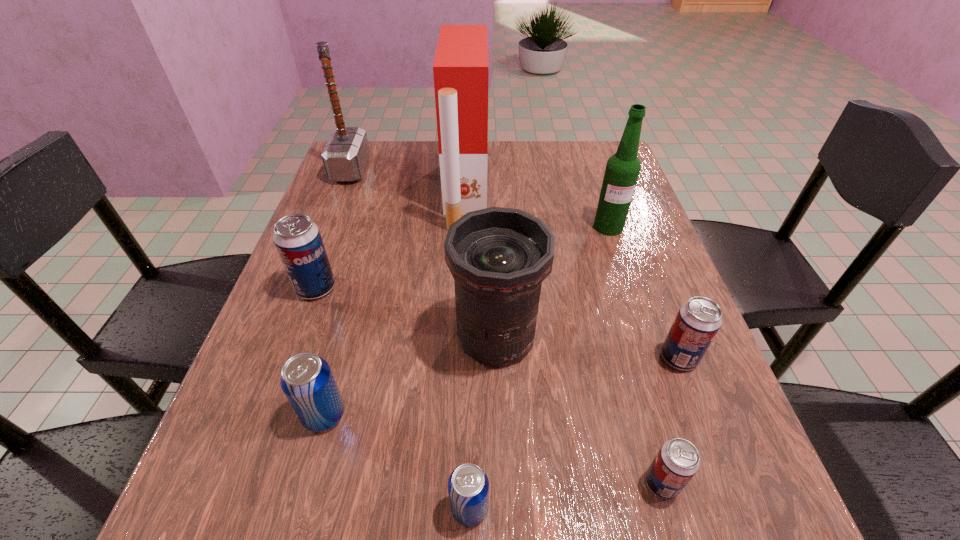
Identify the location of the nearest red beer can. (678, 460).

Locate an element on the screen. The image size is (960, 540). the second red beer can from left to right is located at coordinates click(678, 460).

Where is `the right blue beer can`? the right blue beer can is located at coordinates (468, 486).

Locate an element on the screen. The image size is (960, 540). the smaller blue beer can is located at coordinates (468, 486).

The width and height of the screenshot is (960, 540). What are the coordinates of `free space located on the front-facing side of the red cigarette case` in the screenshot? It's located at (524, 192).

Find the location of a particular element. The width and height of the screenshot is (960, 540). free location located 0.080m on the striking surface of the hammer is located at coordinates (396, 170).

I want to click on vacant space situated 0.190m on the label of the green beer bottle, so point(632,296).

Identify the location of free location located 0.260m on the left of the telephoto lens. Image resolution: width=960 pixels, height=540 pixels. (312, 336).

The width and height of the screenshot is (960, 540). I want to click on free space located 0.130m on the right of the leftmost red beer can, so click(x=398, y=288).

The height and width of the screenshot is (540, 960). In order to click on vacant space located on the left of the fourth nearest beer can in this screenshot , I will do `click(611, 357)`.